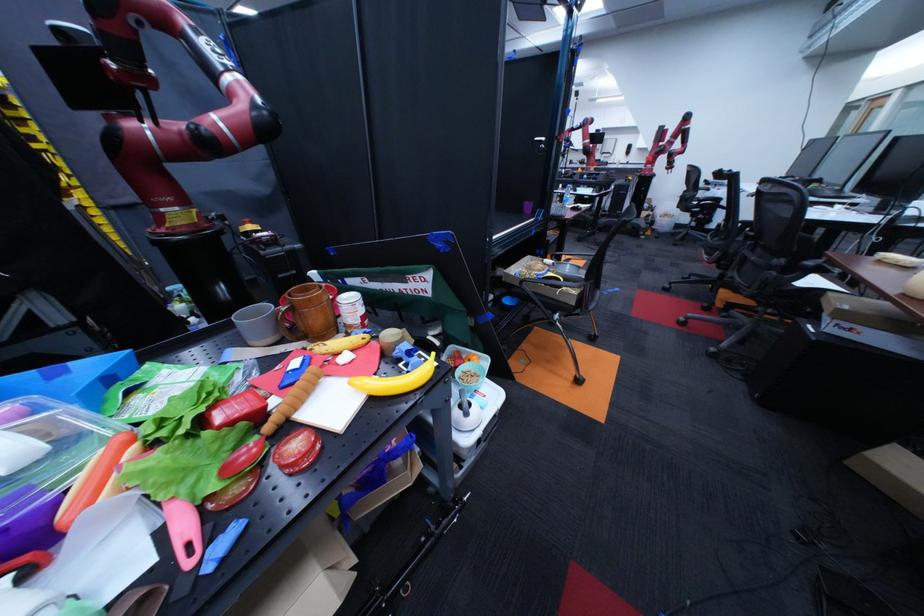
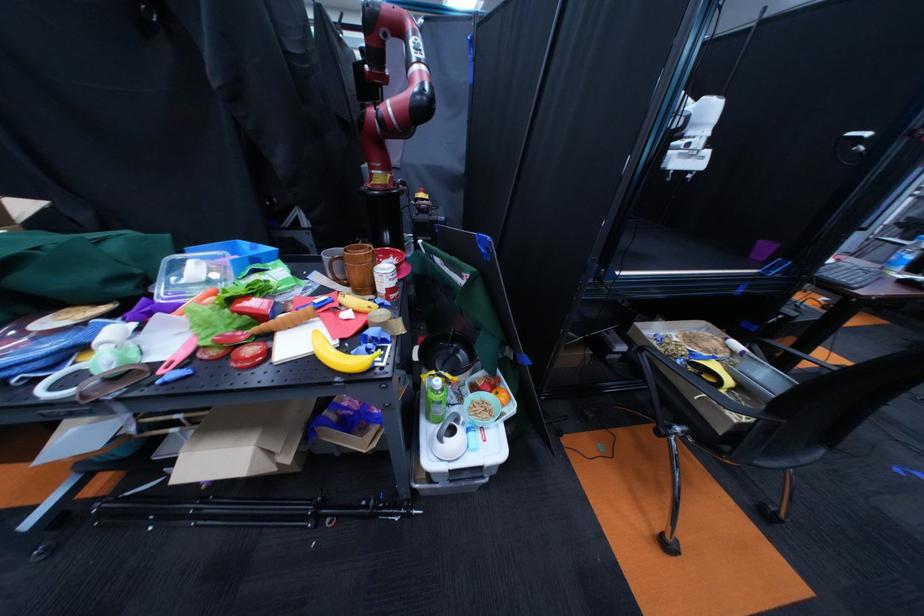
Locate, in the second image, the point that corresponds to [123,379] in the first image.

(268, 261)